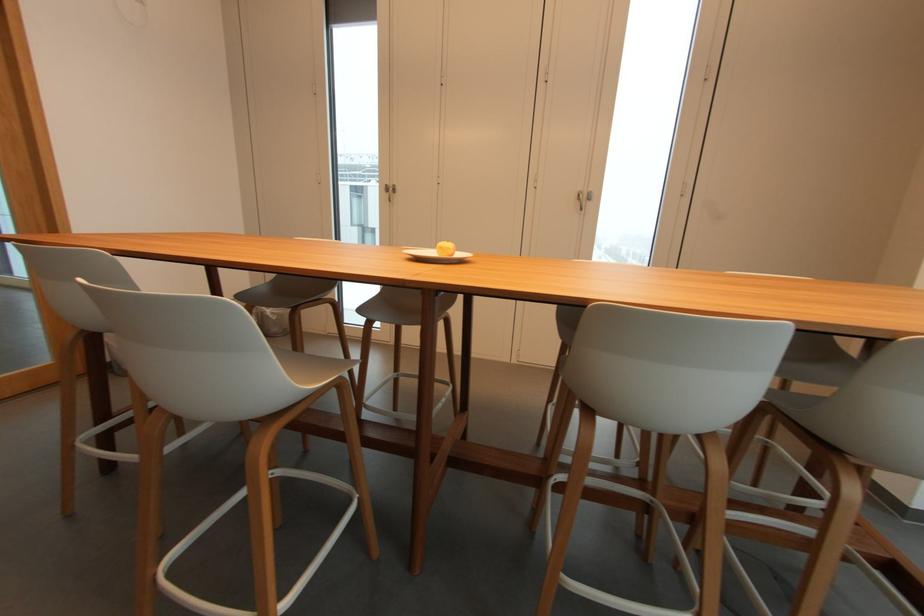
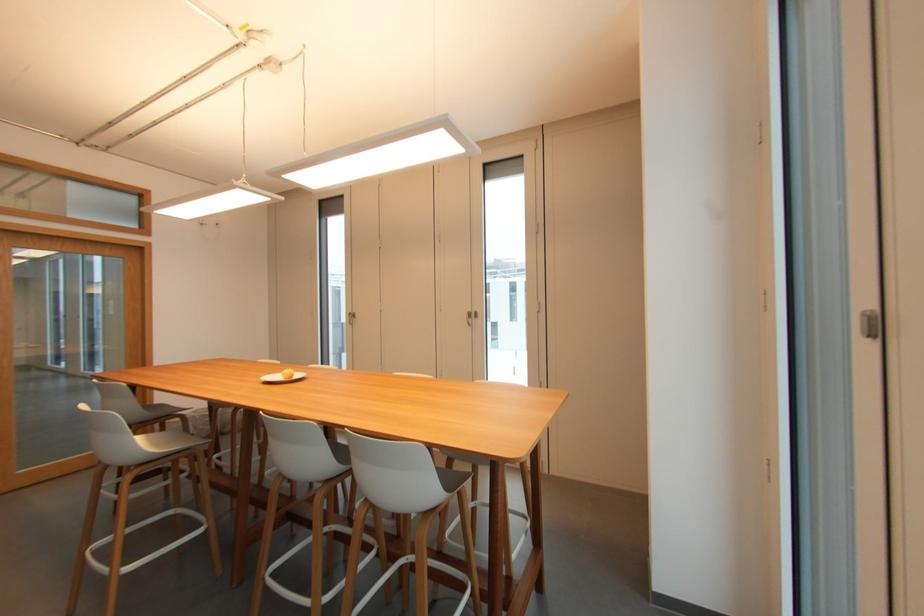
Find the pixel in the second image that matches point (456, 254) in the first image.

(296, 377)